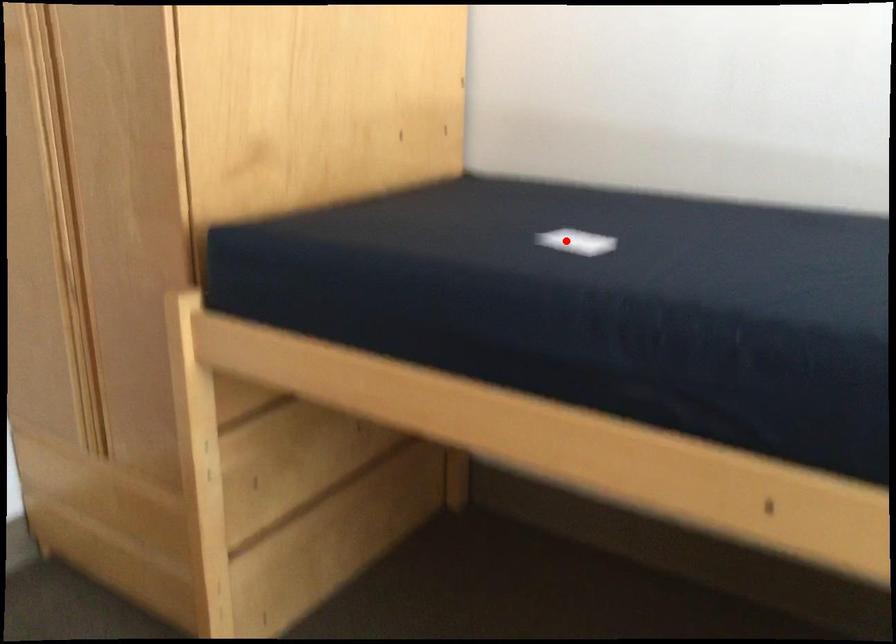
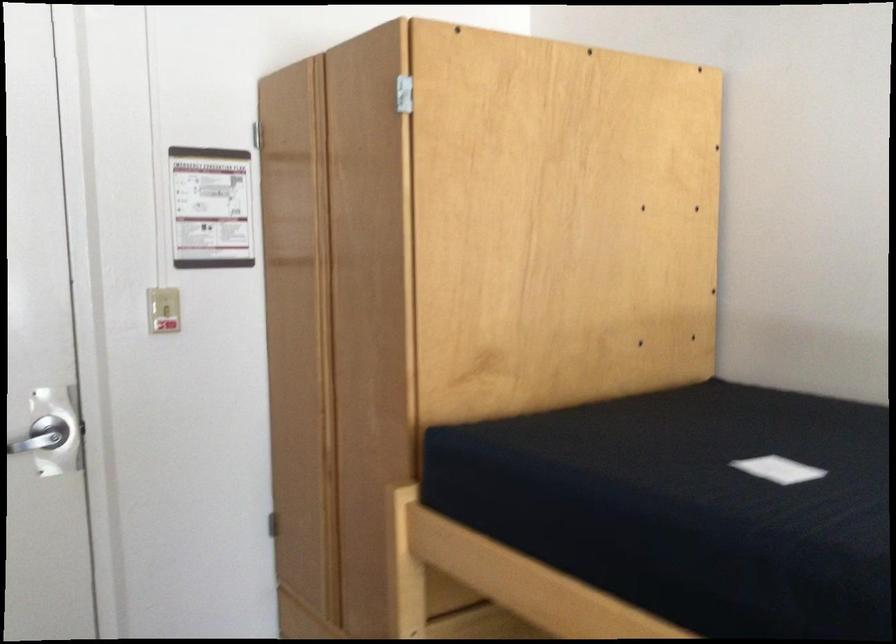
Locate, in the second image, the point that corresponds to the highlighted location in the first image.

(778, 469)